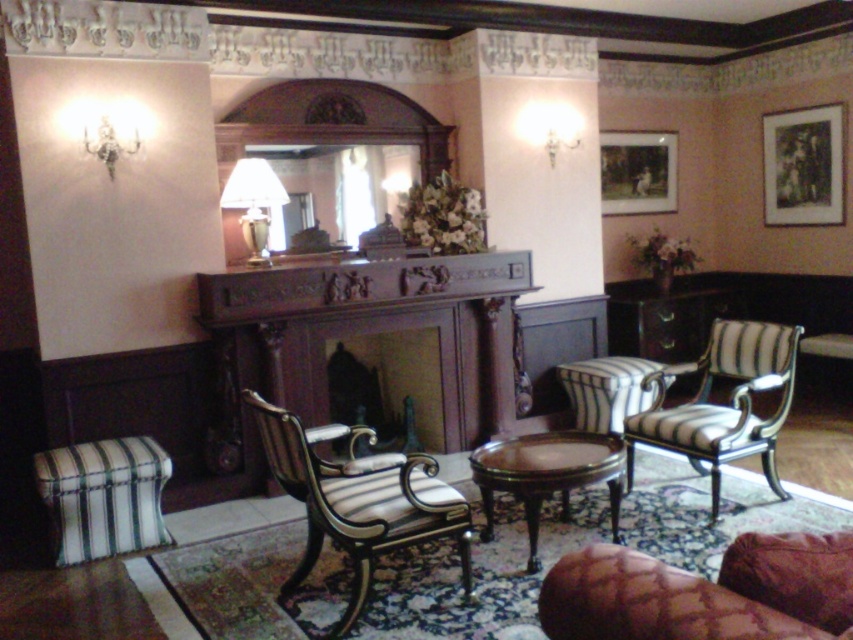
You are arranging a party in the living room and need to move the green striped fabric stool at lower left closer to the wooden picture frame at upper right. Based on their current positions, which direction should you move the stool to get it closer to the frame?

The green striped fabric stool at lower left is positioned on the left side of the wooden picture frame at upper right, so to move it closer, you should move the stool to the right.

You are standing in the living room and want to move from point A to point B. Point A is at coordinate point (155, 481) and point B is at coordinate point (610, 196). According to the image, which point is closer to you when you are facing the fireplace?

Point A at coordinate point (155, 481) is closer to you because it is in front of point B at coordinate point (610, 196).

You are planning to place a new sofa in the living room. The sofa is the same size as the wooden picture frame at upper right. Based on the current arrangement, will the sofa fit in the space where the striped fabric armchair at right is currently placed?

The striped fabric armchair at right is larger than the wooden picture frame at upper right. Since the sofa is the same size as the wooden picture frame at upper right, it would be smaller and therefore should fit in the space currently occupied by the striped fabric armchair at right.